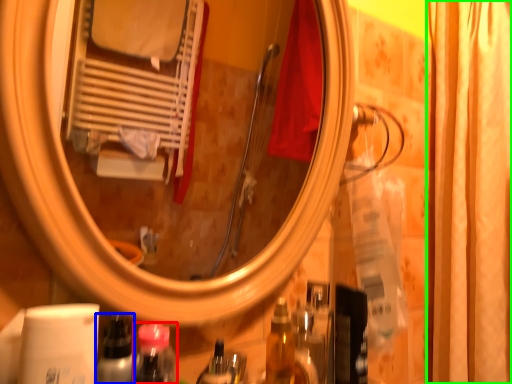
Question: Based on their relative distances, which object is farther from mouthwash (highlighted by a red box)? Choose from bottle (highlighted by a blue box) and shower curtain (highlighted by a green box).

Choices:
 (A) bottle
 (B) shower curtain

Answer: (B)